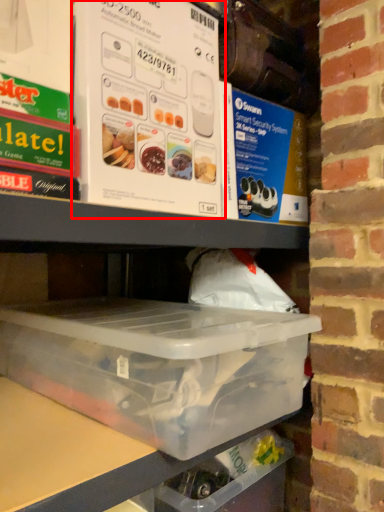
Question: In this image, where is box (annotated by the red box) located relative to box?

Choices:
 (A) right
 (B) left

Answer: (B)